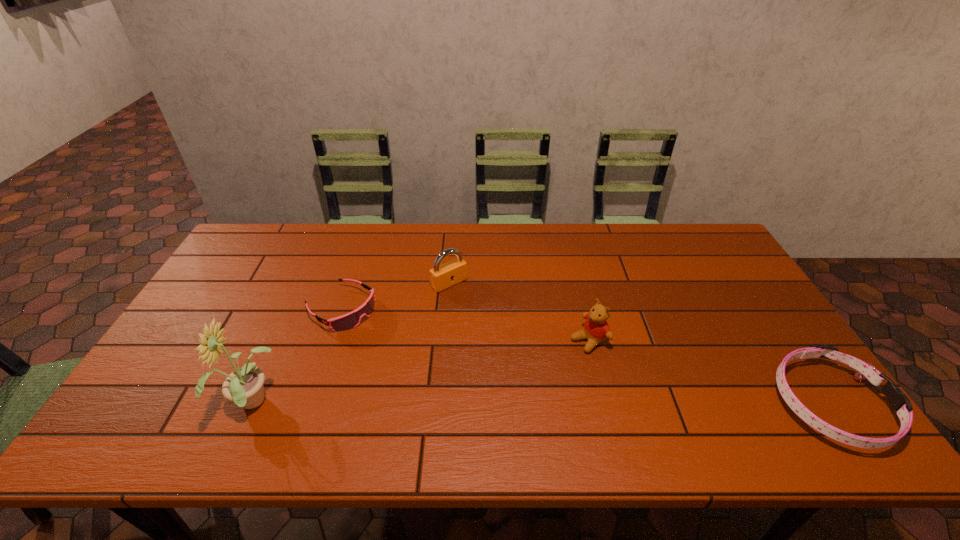
The width and height of the screenshot is (960, 540). Identify the location of free space on the desktop that is between the sunflower and the rightmost object and is positioned on the front-facing side of the goggles. (486, 404).

Locate an element on the screen. Image resolution: width=960 pixels, height=540 pixels. vacant spot on the desktop that is between the tallest object and the rightmost object and is positioned to unlock the padlock from the front is located at coordinates (568, 404).

You are a GUI agent. You are given a task and a screenshot of the screen. Output one action in this format:
    pyautogui.click(x=<x>, y=<y>)
    Task: Click on the vacant space on the desktop that is between the tallest object and the rightmost object and is positioned on the front-facing side of the fourth object from left to right
    
    Given the screenshot: What is the action you would take?
    pyautogui.click(x=478, y=404)